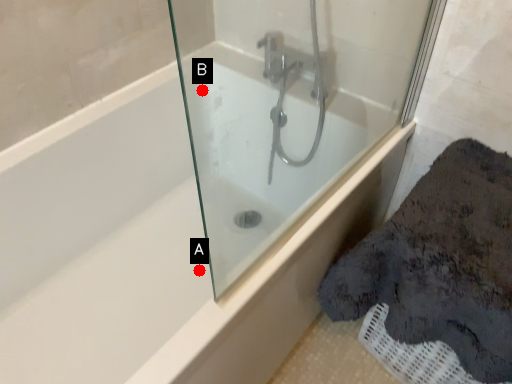
Question: Two points are circled on the image, labeled by A and B beside each circle. Which point is closer to the camera taking this photo?

Choices:
 (A) A is closer
 (B) B is closer

Answer: (B)